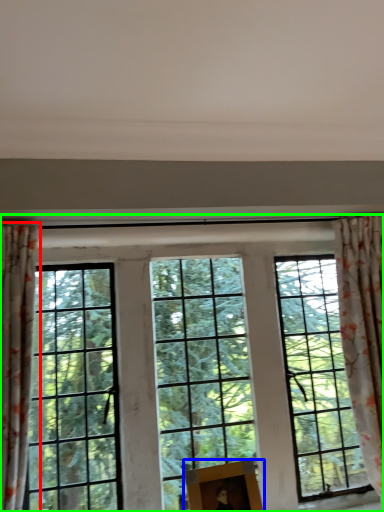
Question: Which is farther away from curtain (highlighted by a red box)? picture frame (highlighted by a blue box) or window (highlighted by a green box)?

Choices:
 (A) picture frame
 (B) window

Answer: (A)